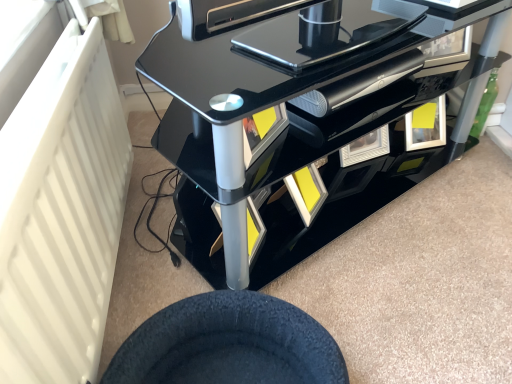
Question: From a real-world perspective, is glossy black entertainment unit at center positioned over black fuzzy wheel at lower center based on gravity?

Choices:
 (A) no
 (B) yes

Answer: (B)

Question: Does glossy black entertainment unit at center appear on the right side of black fuzzy wheel at lower center?

Choices:
 (A) no
 (B) yes

Answer: (B)

Question: Does glossy black entertainment unit at center turn towards black fuzzy wheel at lower center?

Choices:
 (A) no
 (B) yes

Answer: (A)

Question: Does glossy black entertainment unit at center have a larger size compared to black fuzzy wheel at lower center?

Choices:
 (A) no
 (B) yes

Answer: (B)

Question: From a real-world perspective, is glossy black entertainment unit at center physically below black fuzzy wheel at lower center?

Choices:
 (A) no
 (B) yes

Answer: (A)

Question: Can you confirm if glossy black entertainment unit at center is positioned to the left of black fuzzy wheel at lower center?

Choices:
 (A) no
 (B) yes

Answer: (A)

Question: From a real-world perspective, does black fuzzy wheel at lower center stand above glossy black entertainment unit at center?

Choices:
 (A) yes
 (B) no

Answer: (B)

Question: Does black fuzzy wheel at lower center have a lesser height compared to glossy black entertainment unit at center?

Choices:
 (A) yes
 (B) no

Answer: (A)

Question: From the image's perspective, is black fuzzy wheel at lower center above glossy black entertainment unit at center?

Choices:
 (A) yes
 (B) no

Answer: (B)

Question: Can you confirm if black fuzzy wheel at lower center is positioned to the left of glossy black entertainment unit at center?

Choices:
 (A) no
 (B) yes

Answer: (B)

Question: Would you say black fuzzy wheel at lower center is outside glossy black entertainment unit at center?

Choices:
 (A) yes
 (B) no

Answer: (A)

Question: Is glossy black entertainment unit at center completely or partially inside black fuzzy wheel at lower center?

Choices:
 (A) yes
 (B) no

Answer: (B)

Question: From a real-world perspective, is black fuzzy wheel at lower center above or below glossy black entertainment unit at center?

Choices:
 (A) above
 (B) below

Answer: (B)